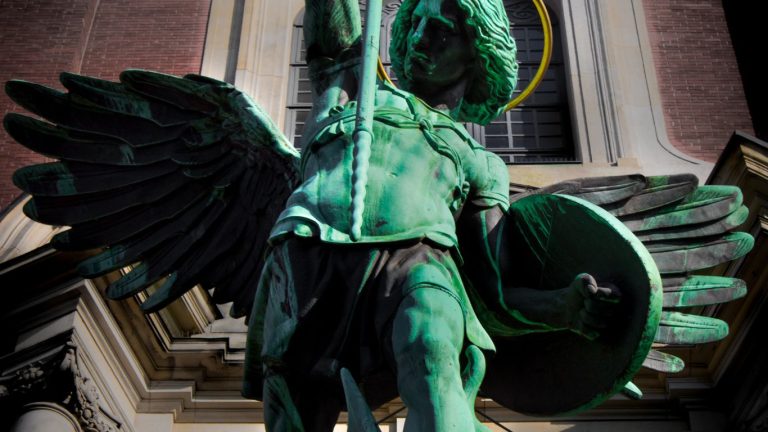
This screenshot has height=432, width=768. Identify the location of top of column. (28, 420).